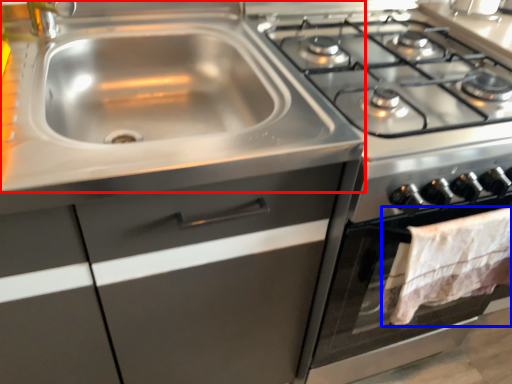
Question: Among these objects, which one is farthest to the camera, sink (highlighted by a red box) or blanket (highlighted by a blue box)?

Choices:
 (A) sink
 (B) blanket

Answer: (B)